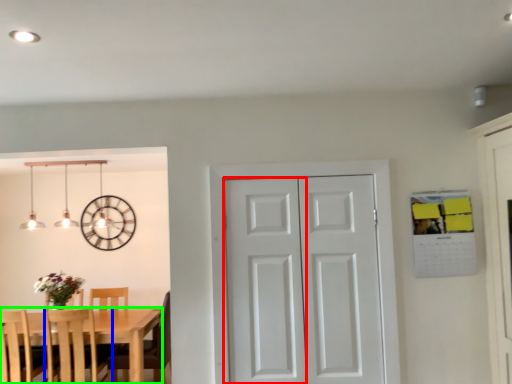
Question: Which object is the closest to the screen door (highlighted by a red box)? Choose among these: chair (highlighted by a blue box) or kitchen & dining room table (highlighted by a green box).

Choices:
 (A) chair
 (B) kitchen & dining room table

Answer: (B)